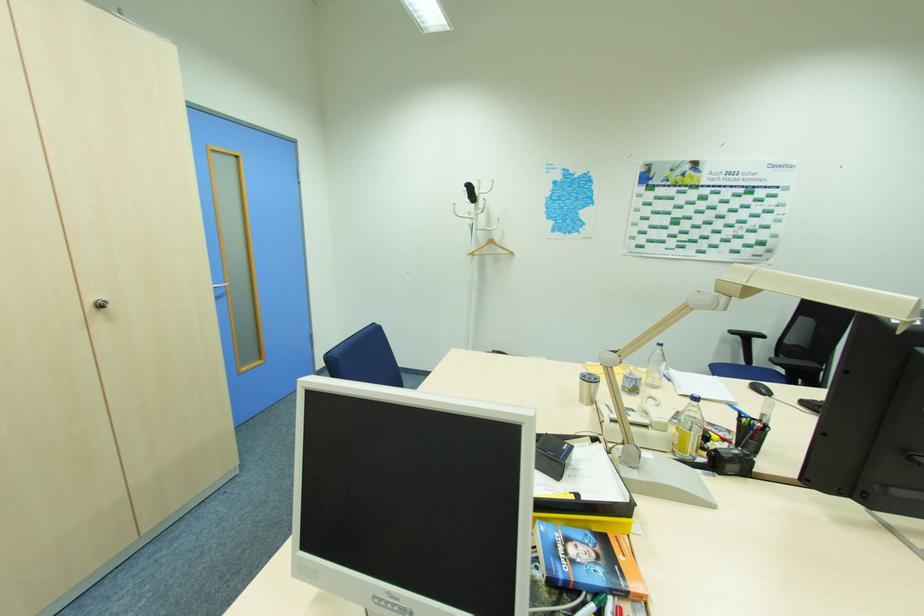
What do you see at coordinates (101, 304) in the screenshot? I see `a silver door handle` at bounding box center [101, 304].